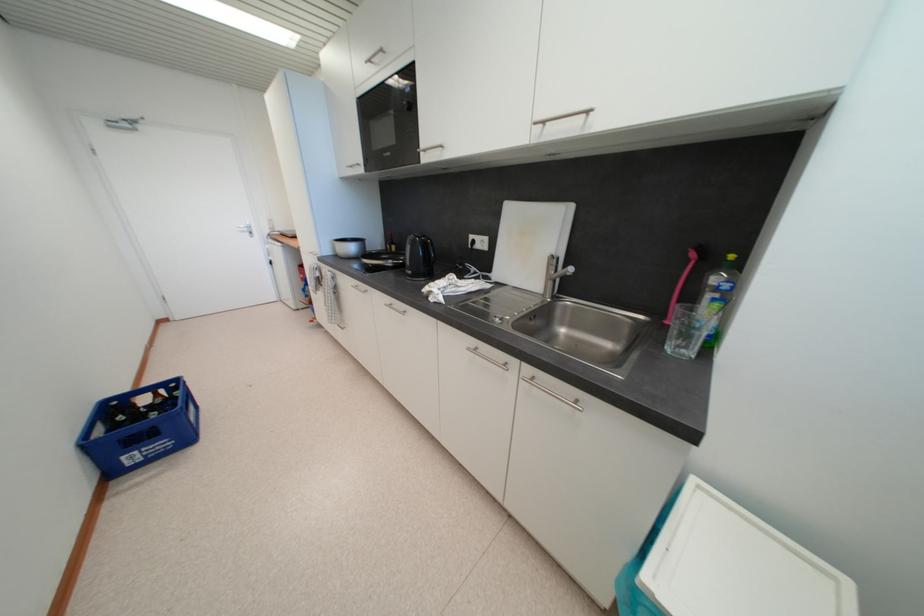
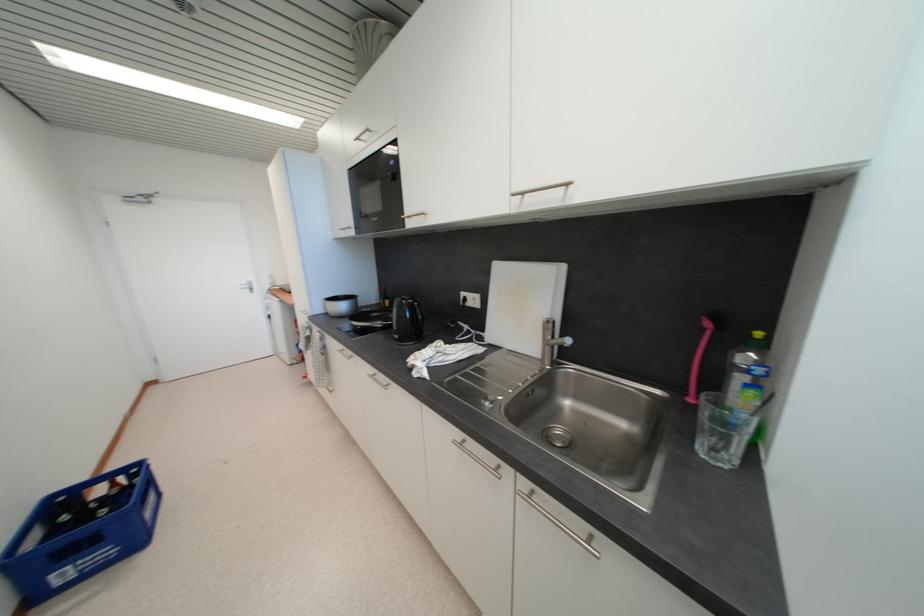
Find the pixel in the second image that matches (685,349) in the first image.

(720, 453)